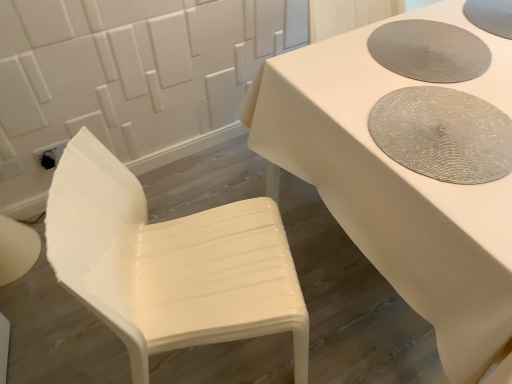
This screenshot has width=512, height=384. In order to click on vacant space behind textured gray mat at upper right, which appears as the 1th manhole cover when ordered from the bottom in this screenshot , I will do `click(397, 60)`.